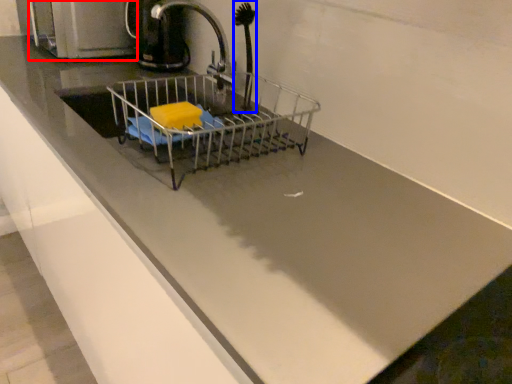
Question: Among these objects, which one is nearest to the camera, appliance (highlighted by a red box) or brush (highlighted by a blue box)?

Choices:
 (A) appliance
 (B) brush

Answer: (B)